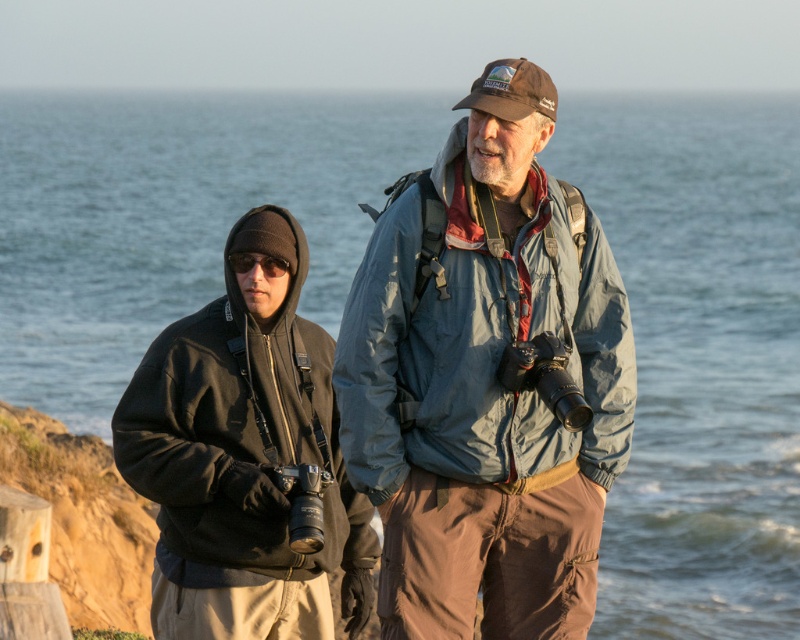
Question: Which point is farther to the camera?

Choices:
 (A) matte blue jacket at center
 (B) dark gray fleece jacket at left

Answer: (B)

Question: Is matte blue jacket at center smaller than dark gray fleece jacket at left?

Choices:
 (A) yes
 (B) no

Answer: (B)

Question: Is matte blue jacket at center positioned at the back of dark gray fleece jacket at left?

Choices:
 (A) yes
 (B) no

Answer: (B)

Question: Does matte blue jacket at center appear over dark gray fleece jacket at left?

Choices:
 (A) yes
 (B) no

Answer: (B)

Question: Among these objects, which one is farthest from the camera?

Choices:
 (A) matte blue jacket at center
 (B) dark gray fleece jacket at left

Answer: (B)